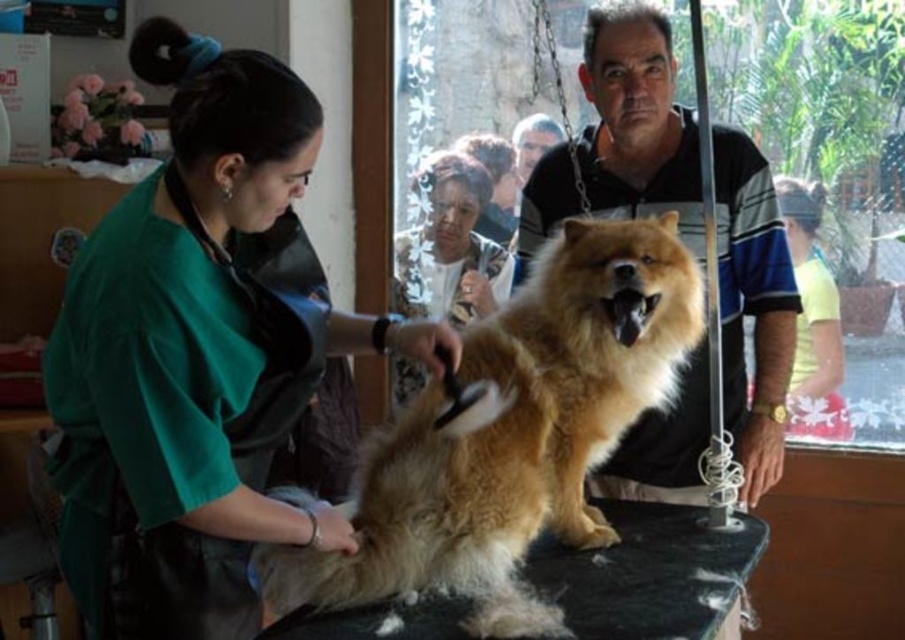
Question: Which of the following is the closest to the observer?

Choices:
 (A) [651, 300]
 (B) [679, 161]
 (C) [160, 499]

Answer: (C)

Question: Can you confirm if fuzzy golden dog at center is positioned below fluffy brown dog at center?

Choices:
 (A) yes
 (B) no

Answer: (A)

Question: Estimate the real-world distances between objects in this image. Which object is farther from the fuzzy golden dog at center?

Choices:
 (A) fluffy brown dog at center
 (B) fluffy brown fur at center

Answer: (B)

Question: Observing the image, what is the correct spatial positioning of fuzzy golden dog at center in reference to black rubber table at center?

Choices:
 (A) left
 (B) right

Answer: (A)

Question: Is fuzzy golden dog at center behind black rubber table at center?

Choices:
 (A) no
 (B) yes

Answer: (B)

Question: Which of the following is the closest to the observer?

Choices:
 (A) green fabric shirt at upper left
 (B) black rubber table at center
 (C) fuzzy golden dog at center

Answer: (A)